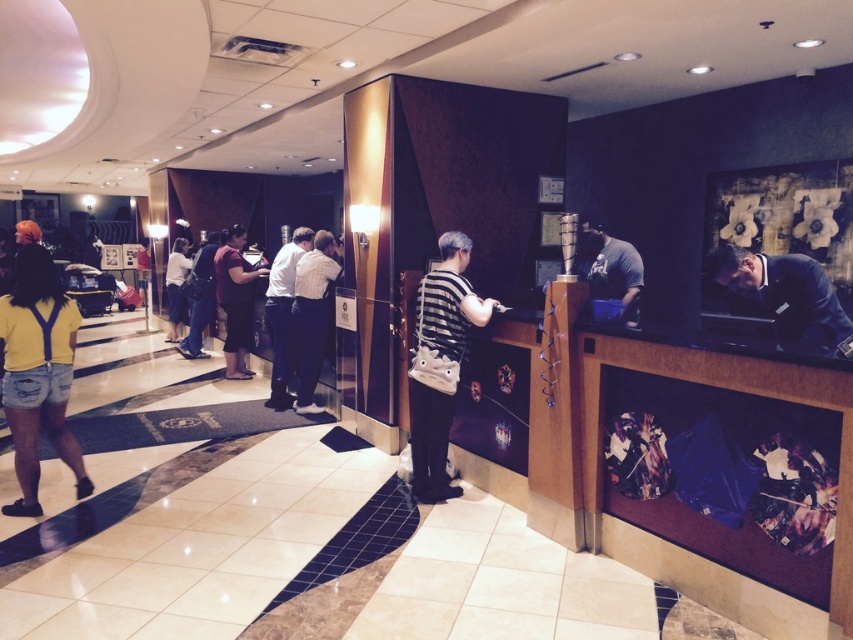
Looking at this image, does black suit at right lie in front of white striped shirt at center?

Yes.

Is point (805, 289) farther from viewer compared to point (309, 385)?

That is False.

Does point (775, 273) lie in front of point (320, 266)?

Yes.

Find the location of `black suit at right`. black suit at right is located at coordinates (784, 292).

Who is more distant from viewer, (196, 289) or (181, 240)?

The point (181, 240) is behind.

Which is behind, point (202, 314) or point (181, 310)?

Positioned behind is point (181, 310).

Where is `denim pants at center`? denim pants at center is located at coordinates (x=200, y=298).

Who is lower down, white striped shirt at center or white shirt at center?

white striped shirt at center

This screenshot has height=640, width=853. In order to click on white striped shirt at center in this screenshot , I will do coord(311,316).

Between point (314, 355) and point (289, 314), which one is positioned in front?

Point (314, 355) is in front.

Where is `white striped shirt at center`? This screenshot has height=640, width=853. white striped shirt at center is located at coordinates (311, 316).